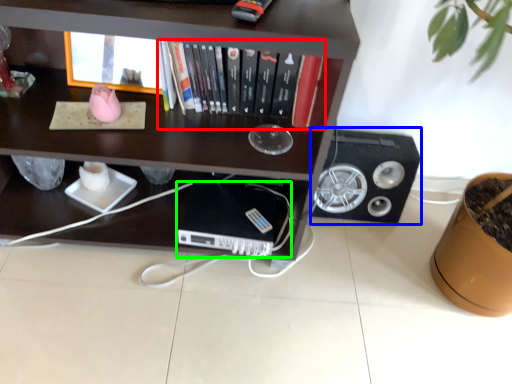
Question: Which object is the closest to the book (highlighted by a red box)? Choose among these: speaker (highlighted by a blue box) or computer (highlighted by a green box).

Choices:
 (A) speaker
 (B) computer

Answer: (B)